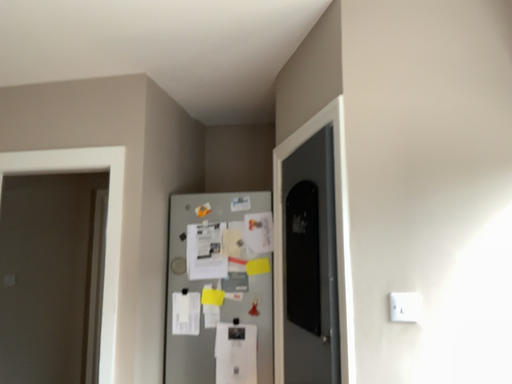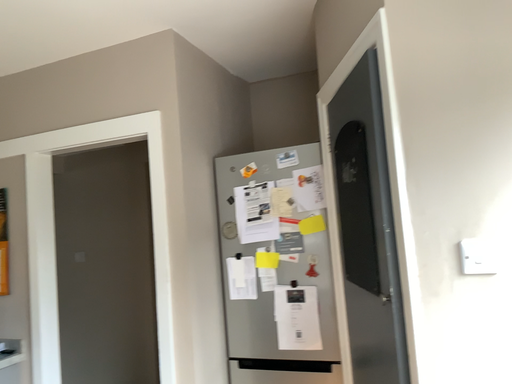
Question: How did the camera likely rotate when shooting the video?

Choices:
 (A) rotated left
 (B) rotated right

Answer: (A)